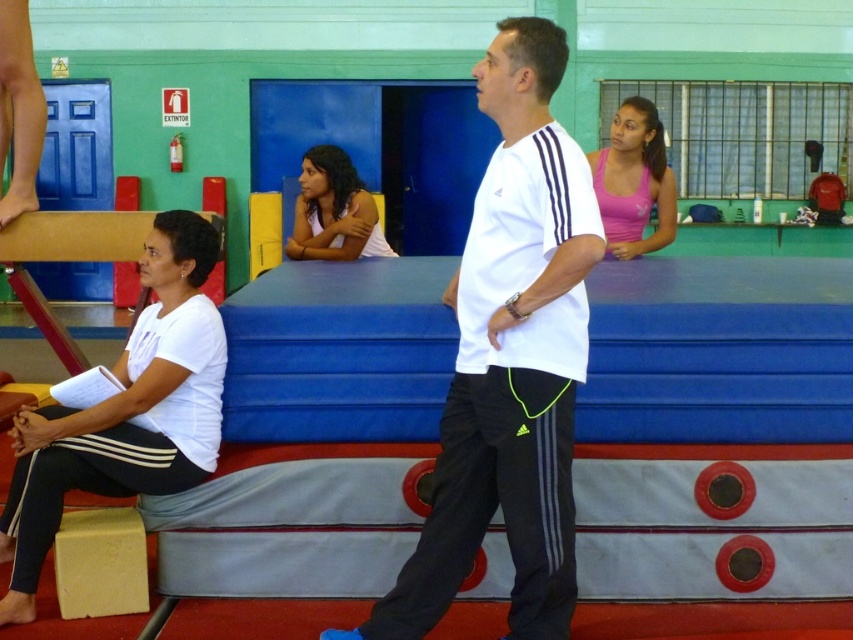
Between pink matte tank top at center and white matte tank top at center, which one appears on the right side from the viewer's perspective?

pink matte tank top at center is more to the right.

Is pink matte tank top at center wider than white matte tank top at center?

No.

Between point (619, 122) and point (296, 236), which one is positioned in front?

Point (619, 122) is in front.

In order to click on pink matte tank top at center in this screenshot , I will do `click(634, 180)`.

Which is in front, point (577, 292) or point (614, 163)?

Point (577, 292) is in front.

Is white matte shirt at center shorter than pink matte tank top at center?

No, white matte shirt at center is not shorter than pink matte tank top at center.

Identify the location of white matte shirt at center. The width and height of the screenshot is (853, 640). (509, 358).

Based on the photo, who is lower down, white matte shirt at center or white matte shirt at left?

Positioned lower is white matte shirt at left.

Locate an element on the screen. white matte shirt at center is located at coordinates (509, 358).

Is point (462, 538) more distant than point (26, 602)?

That is False.

Where is `white matte shirt at center`? white matte shirt at center is located at coordinates (509, 358).